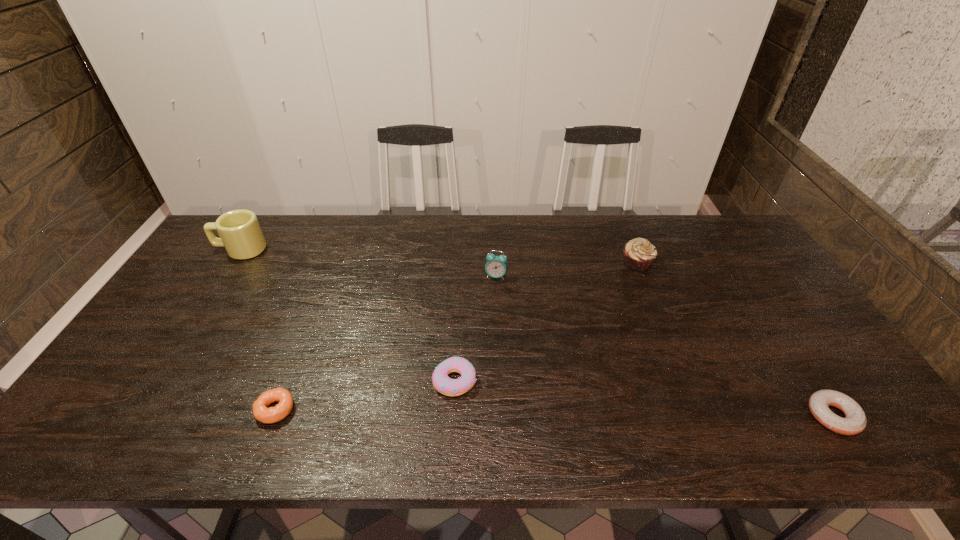
Find the location of a particular element. The image size is (960, 540). the leftmost object is located at coordinates (240, 233).

The image size is (960, 540). I want to click on mug, so click(240, 233).

Image resolution: width=960 pixels, height=540 pixels. I want to click on the fourth object from left to right, so tap(496, 266).

Where is `muffin`? muffin is located at coordinates (639, 254).

You are a GUI agent. You are given a task and a screenshot of the screen. Output one action in this format:
    pyautogui.click(x=<x>, y=<y>)
    Task: Click on the second doughnut from left to right
    Image resolution: width=960 pixels, height=540 pixels.
    Given the screenshot: What is the action you would take?
    pyautogui.click(x=442, y=383)

Locate an element on the screen. Image resolution: width=960 pixels, height=540 pixels. the rightmost doughnut is located at coordinates (855, 420).

Where is `the leftmost doughnut`? the leftmost doughnut is located at coordinates (261, 412).

What are the coordinates of `vacant area situated 0.380m on the face of the alarm clock` in the screenshot? It's located at (500, 384).

At what (x,y) coordinates should I click in order to perform the action: click on free space located 0.070m on the front of the muffin. Please return your answer as a coordinate pair (x, y). This screenshot has width=960, height=540. Looking at the image, I should click on (647, 288).

Where is `blank area located 0.100m on the back of the second doughnut from right to left`? blank area located 0.100m on the back of the second doughnut from right to left is located at coordinates (457, 334).